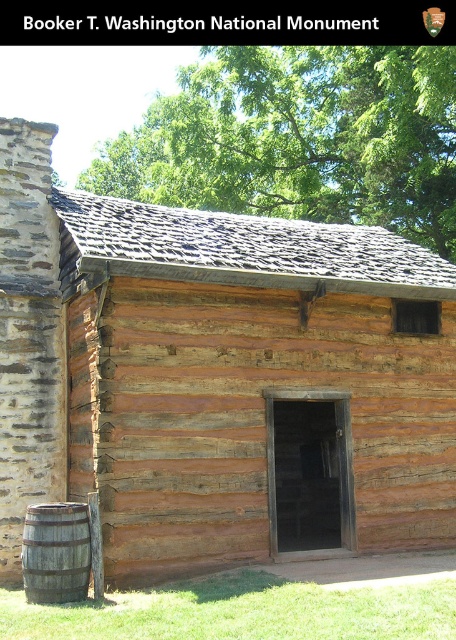
Question: Can you confirm if weathered wood cabin at center is smaller than rustic wooden barrel at lower left?

Choices:
 (A) no
 (B) yes

Answer: (A)

Question: Does weathered wood cabin at center have a lesser width compared to rustic wooden barrel at lower left?

Choices:
 (A) no
 (B) yes

Answer: (A)

Question: Which of the following is the closest to the observer?

Choices:
 (A) rustic wooden barrel at lower left
 (B) weathered wood cabin at center

Answer: (A)

Question: Does weathered wood cabin at center lie in front of rustic wooden barrel at lower left?

Choices:
 (A) no
 (B) yes

Answer: (A)